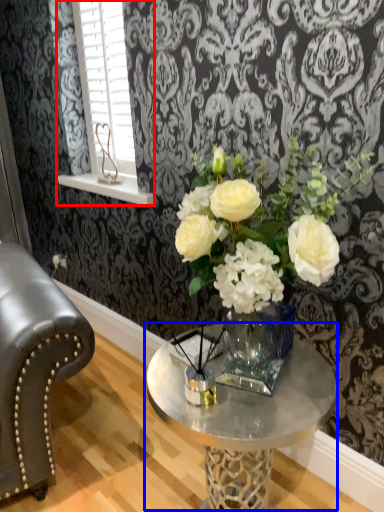
Question: Among these objects, which one is nearest to the camera, window (highlighted by a red box) or coffee table (highlighted by a blue box)?

Choices:
 (A) window
 (B) coffee table

Answer: (B)